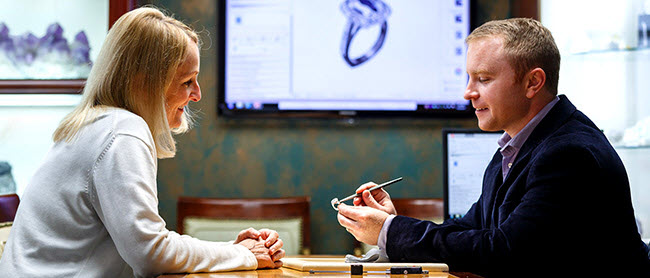
You are a GUI agent. You are given a task and a screenshot of the screen. Output one action in this format:
    pyautogui.click(x=<x>, y=<y>)
    Task: Click on the table
    Image resolution: width=650 pixels, height=278 pixels.
    Given the screenshot: What is the action you would take?
    pyautogui.click(x=283, y=268)